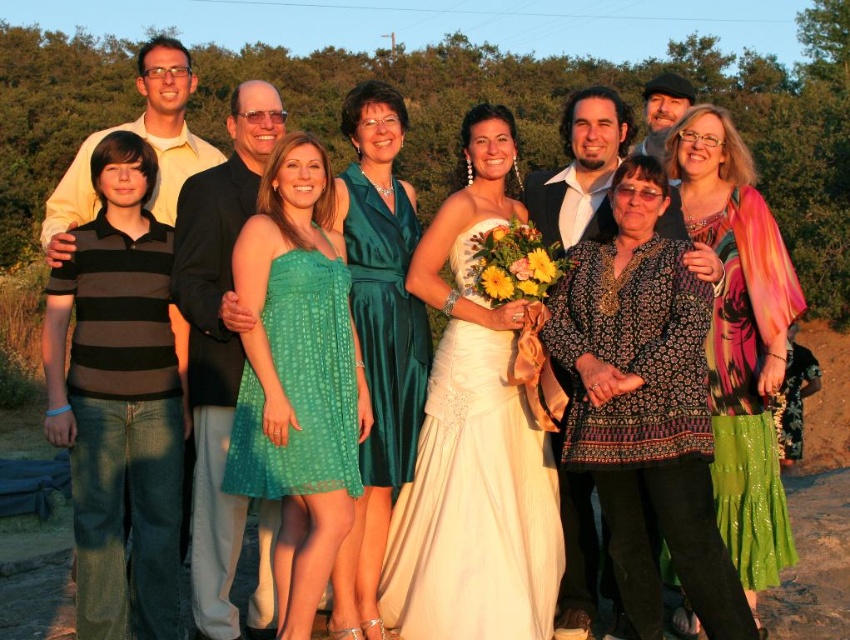
Is black satin suit at center above matte black shirt at center?

No, black satin suit at center is not above matte black shirt at center.

In the scene shown: Can you confirm if black satin suit at center is positioned to the right of matte black shirt at center?

In fact, black satin suit at center is to the left of matte black shirt at center.

Describe the element at coordinates (218, 340) in the screenshot. I see `black satin suit at center` at that location.

The height and width of the screenshot is (640, 850). Find the location of `black satin suit at center`. black satin suit at center is located at coordinates (218, 340).

Is green dotted dress at center in front of matte black shirt at center?

That is True.

Which is above, green dotted dress at center or matte black shirt at center?

matte black shirt at center is above.

Is point (330, 179) closer to viewer compared to point (599, 90)?

Yes.

Where is `green dotted dress at center`? green dotted dress at center is located at coordinates (298, 376).

Is multicolored silk dress at center wider than matte black shirt at center?

In fact, multicolored silk dress at center might be narrower than matte black shirt at center.

Which is above, multicolored silk dress at center or matte black shirt at center?

Positioned higher is matte black shirt at center.

Is point (741, 141) positioned in front of point (607, 147)?

No, it is not.

Where is `multicolored silk dress at center`? This screenshot has height=640, width=850. multicolored silk dress at center is located at coordinates (740, 339).